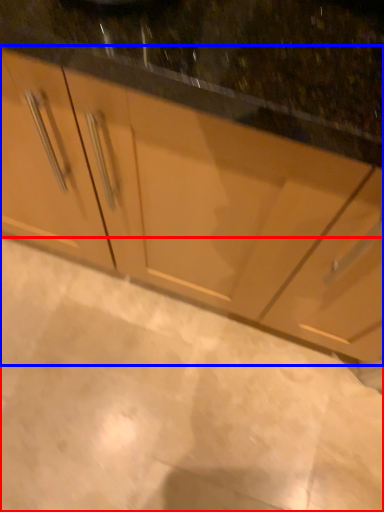
Question: Which of the following is the closest to the observer, granite (highlighted by a red box) or cabinetry (highlighted by a blue box)?

Choices:
 (A) granite
 (B) cabinetry

Answer: (B)